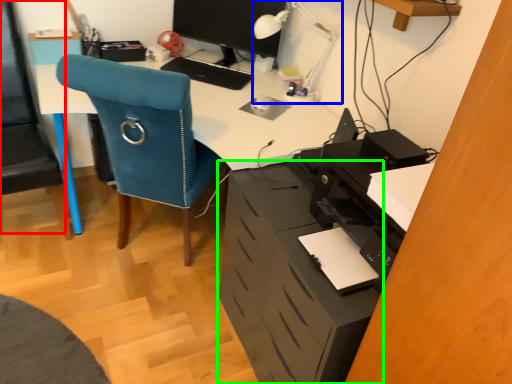
Question: Based on their relative distances, which object is nearer to computer chair (highlighted by a red box)? Choose from table lamp (highlighted by a blue box) and file cabinet (highlighted by a green box).

Choices:
 (A) table lamp
 (B) file cabinet

Answer: (B)